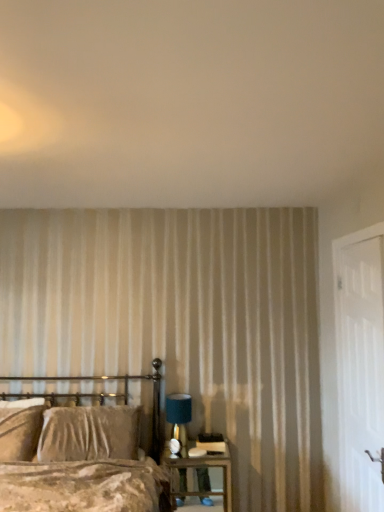
This screenshot has height=512, width=384. Find the location of `empty space that is ontop of wooden nightstand at lower right (from a real-world perspective)`. empty space that is ontop of wooden nightstand at lower right (from a real-world perspective) is located at coordinates (200, 452).